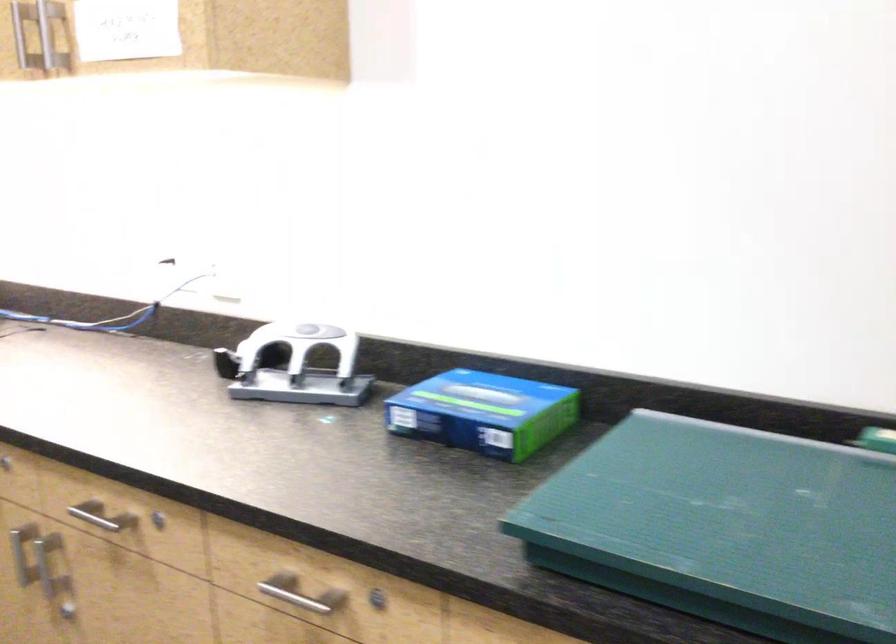
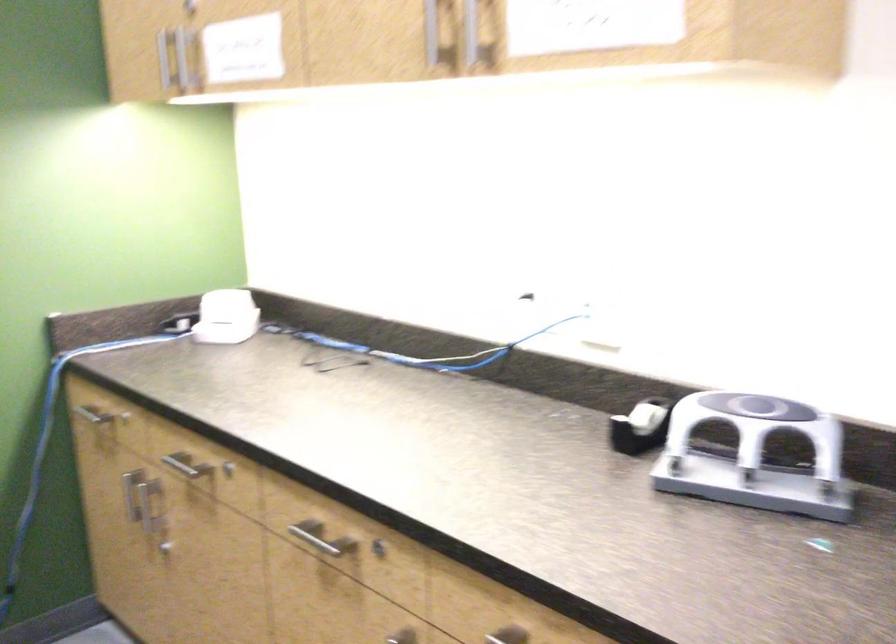
What movement of the cameraman would produce the second image?

The movement direction of the cameraman is left, forward.